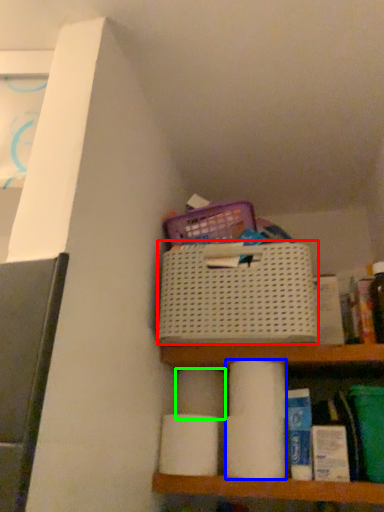
Question: Which object is the farthest from basket (highlighted by a red box)? Choose among these: toilet paper (highlighted by a blue box) or toilet paper (highlighted by a green box).

Choices:
 (A) toilet paper
 (B) toilet paper

Answer: (B)